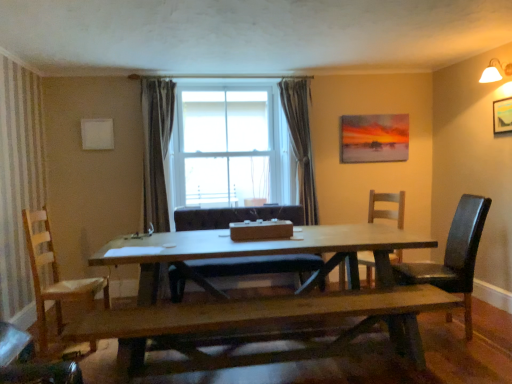
Question: Is wooden bench at center facing towards wooden picture frame at upper right, acting as the first picture frame starting from the right?

Choices:
 (A) no
 (B) yes

Answer: (A)

Question: From a real-world perspective, does wooden bench at center sit lower than wooden picture frame at upper right, marked as the 1th picture frame in a front-to-back arrangement?

Choices:
 (A) no
 (B) yes

Answer: (B)

Question: Is wooden picture frame at upper right, acting as the first picture frame starting from the right, at the back of wooden bench at center?

Choices:
 (A) yes
 (B) no

Answer: (B)

Question: Can you confirm if wooden bench at center is positioned to the right of wooden picture frame at upper right, which is counted as the second picture frame, starting from the back?

Choices:
 (A) no
 (B) yes

Answer: (A)

Question: Considering the relative sizes of wooden bench at center and wooden picture frame at upper right, which is counted as the second picture frame, starting from the back, in the image provided, is wooden bench at center taller than wooden picture frame at upper right, which is counted as the second picture frame, starting from the back,?

Choices:
 (A) no
 (B) yes

Answer: (B)

Question: Is wooden bench at center positioned beyond the bounds of wooden picture frame at upper right, acting as the first picture frame starting from the right?

Choices:
 (A) no
 (B) yes

Answer: (B)

Question: Is dark gray textured curtain at center facing towards white fabric lampshade at upper right?

Choices:
 (A) yes
 (B) no

Answer: (B)

Question: Does dark gray textured curtain at center have a smaller size compared to white fabric lampshade at upper right?

Choices:
 (A) yes
 (B) no

Answer: (B)

Question: From a real-world perspective, is dark gray textured curtain at center on white fabric lampshade at upper right?

Choices:
 (A) yes
 (B) no

Answer: (B)

Question: Is dark gray textured curtain at center bigger than white fabric lampshade at upper right?

Choices:
 (A) no
 (B) yes

Answer: (B)

Question: Is dark gray textured curtain at center oriented away from white fabric lampshade at upper right?

Choices:
 (A) yes
 (B) no

Answer: (B)

Question: From the image's perspective, is dark gray textured curtain at center on top of white fabric lampshade at upper right?

Choices:
 (A) no
 (B) yes

Answer: (A)

Question: Can you confirm if black leather chair at right, the 4th chair in the left-to-right sequence, is positioned to the right of matte acrylic painting at upper right, acting as the second picture frame starting from the front?

Choices:
 (A) yes
 (B) no

Answer: (A)